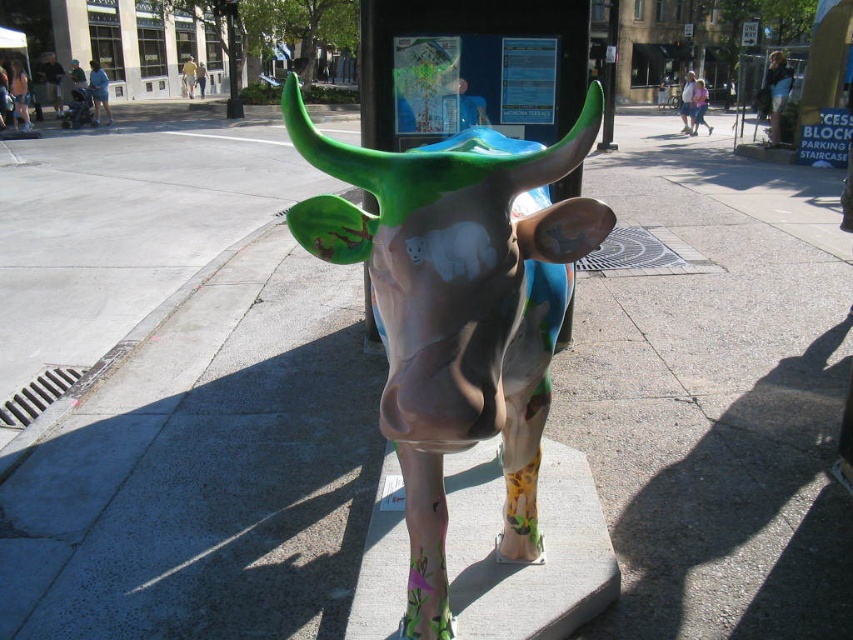
Between painted ceramic cow at center and matte plastic cow at center, which one has less height?

Standing shorter between the two is matte plastic cow at center.

Based on the photo, which is more to the left, painted ceramic cow at center or matte plastic cow at center?

matte plastic cow at center is more to the left.

The height and width of the screenshot is (640, 853). Find the location of `painted ceramic cow at center`. painted ceramic cow at center is located at coordinates (457, 308).